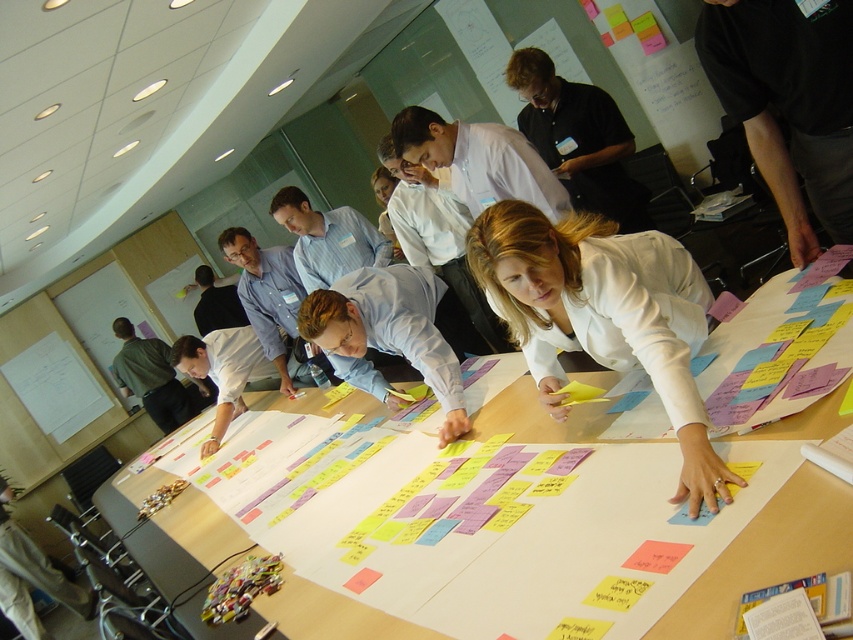
Between white matte shirt at center and white paper at center, which one has less height?

white paper at center

Which is behind, point (650, 358) or point (705, 598)?

The point (650, 358) is behind.

You are a GUI agent. You are given a task and a screenshot of the screen. Output one action in this format:
    pyautogui.click(x=<x>, y=<y>)
    Task: Click on the white matte shirt at center
    
    Given the screenshot: What is the action you would take?
    pyautogui.click(x=602, y=316)

Looking at this image, who is more forward, (738, 436) or (552, 156)?

Point (738, 436) is more forward.

In the scene shown: Can you confirm if white paper at center is smaller than black shirt at upper center?

Yes.

Does point (339, 627) come behind point (619, 195)?

No, (339, 627) is closer to viewer.

At what (x,y) coordinates should I click in order to perform the action: click on white paper at center. Please return your answer as a coordinate pair (x, y). Looking at the image, I should click on (770, 554).

Identify the location of white matte shirt at center. This screenshot has height=640, width=853. (602, 316).

Is point (560, 234) farther from viewer compared to point (607, 186)?

No, it is not.

The image size is (853, 640). What are the coordinates of `white matte shirt at center` in the screenshot? It's located at (602, 316).